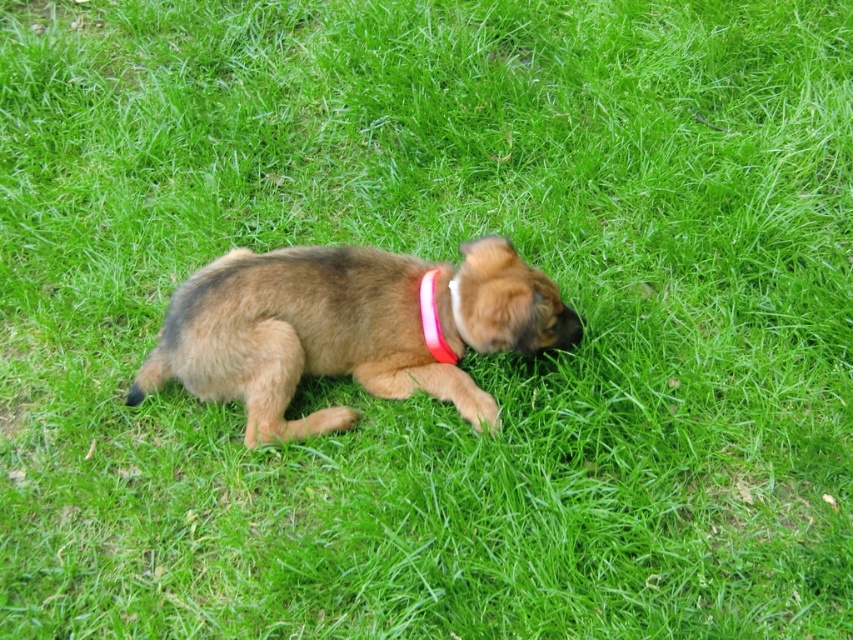
Who is taller, brown furry dog at center or pink fabric neckband at center?

brown furry dog at center is taller.

In the scene shown: Is brown furry dog at center thinner than pink fabric neckband at center?

In fact, brown furry dog at center might be wider than pink fabric neckband at center.

Does point (242, 362) come in front of point (442, 342)?

Yes, point (242, 362) is in front of point (442, 342).

Locate an element on the screen. This screenshot has height=640, width=853. brown furry dog at center is located at coordinates (347, 328).